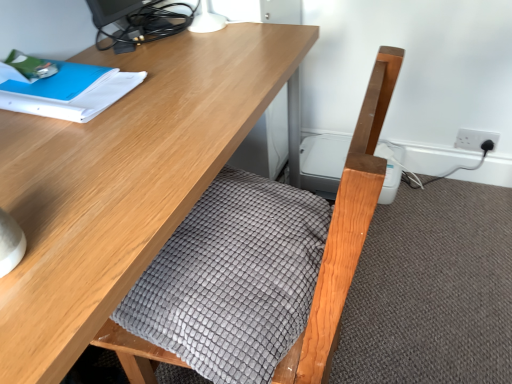
This screenshot has height=384, width=512. What are the coordinates of `free spot below matte black monitor at upper left (from a real-world perspective)` in the screenshot? It's located at (148, 46).